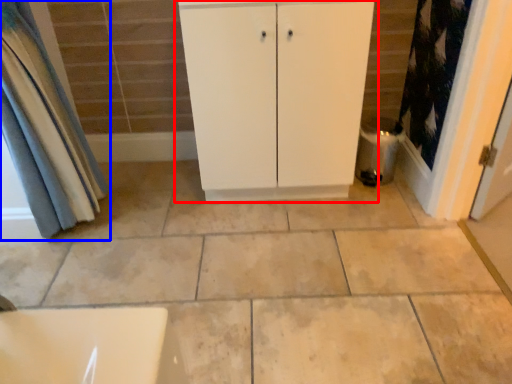
Question: Which point is closer to the camera, bathroom cabinet (highlighted by a red box) or curtain (highlighted by a blue box)?

Choices:
 (A) bathroom cabinet
 (B) curtain

Answer: (B)